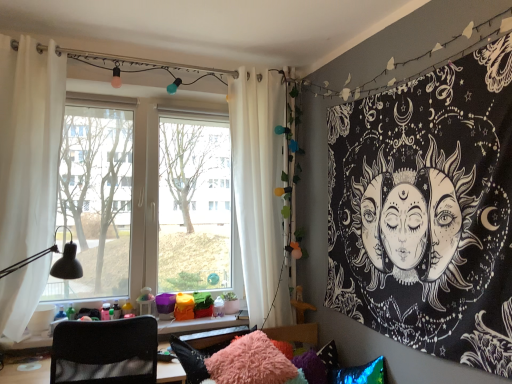
This screenshot has width=512, height=384. Find the location of `blank space above transparent glass window at center (from a real-world perspective)`. blank space above transparent glass window at center (from a real-world perspective) is located at coordinates (156, 88).